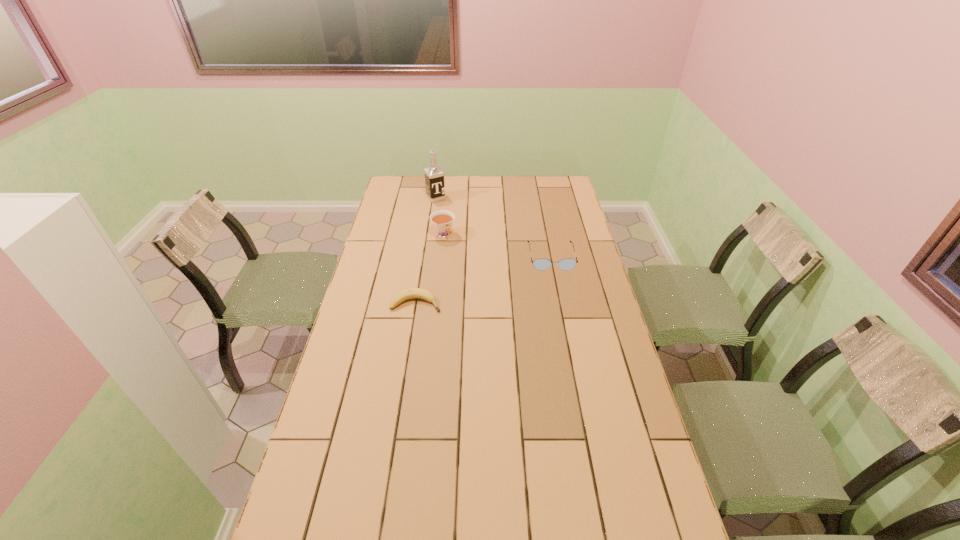
Identify the location of free spot at the left edge of the desktop. The width and height of the screenshot is (960, 540). (348, 424).

The width and height of the screenshot is (960, 540). What are the coordinates of `vacant space at the right edge of the desktop` in the screenshot? It's located at (612, 338).

In the image, there is a desktop. Where is `free space at the far left corner`? The height and width of the screenshot is (540, 960). free space at the far left corner is located at coordinates (413, 200).

In the image, there is a desktop. Where is `vacant space at the far right corner`? vacant space at the far right corner is located at coordinates (544, 178).

Locate an element on the screen. The height and width of the screenshot is (540, 960). vacant space that is in between the nearest object and the rightmost object is located at coordinates (484, 280).

At what (x,y) coordinates should I click in order to perform the action: click on free space between the third shortest object and the second nearest object. Please return your answer as a coordinate pair (x, y). This screenshot has height=540, width=960. Looking at the image, I should click on (497, 246).

Where is `vacant area that lies between the shortest object and the teacup`? vacant area that lies between the shortest object and the teacup is located at coordinates (430, 269).

This screenshot has width=960, height=540. Identify the location of unoccupied area between the banana and the vodka. (426, 251).

You are a GUI agent. You are given a task and a screenshot of the screen. Output one action in this format:
    pyautogui.click(x=<x>, y=<y>)
    Task: Click on the free space between the farthest object and the rightmost object
    The image size is (960, 540).
    Given the screenshot: What is the action you would take?
    pyautogui.click(x=493, y=227)

The width and height of the screenshot is (960, 540). I want to click on empty space that is in between the third shortest object and the banana, so click(430, 269).